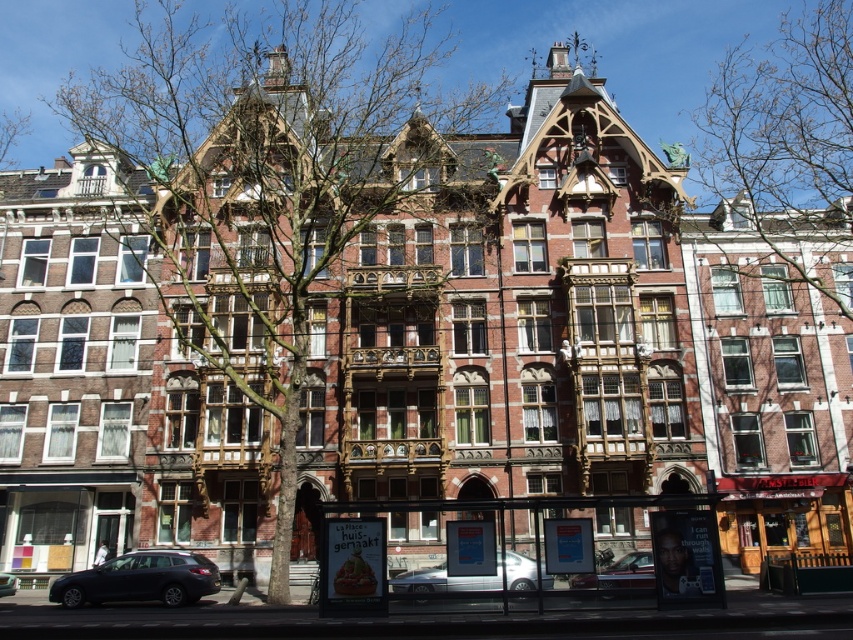
You are standing in front of the grand building and notice two points marked on the facade. The first point is at coordinate point [790,193] and the second at point [422,577]. Which point is closer to you as you face the building?

Point [422,577] is closer to you because it is in front of point [790,193].

You are a photographer standing at the base of the grand building. You want to capture a closeup shot of the bare branches at center without any distortion. Considering your current position, do you think you can achieve this without moving closer than 50 meters?

The distance between you and the bare branches at center is 50.28 meters. Since you cannot move closer than 50 meters, you are just slightly too far away to capture a closeup without distortion. You need to move at least 28 centimeters closer to avoid distortion.

You are standing in front of the grand ornate building and notice a silver metallic car at center and some bare branches at upper center. Which object appears taller from your viewpoint?

The bare branches at upper center appears taller than the silver metallic car at center.